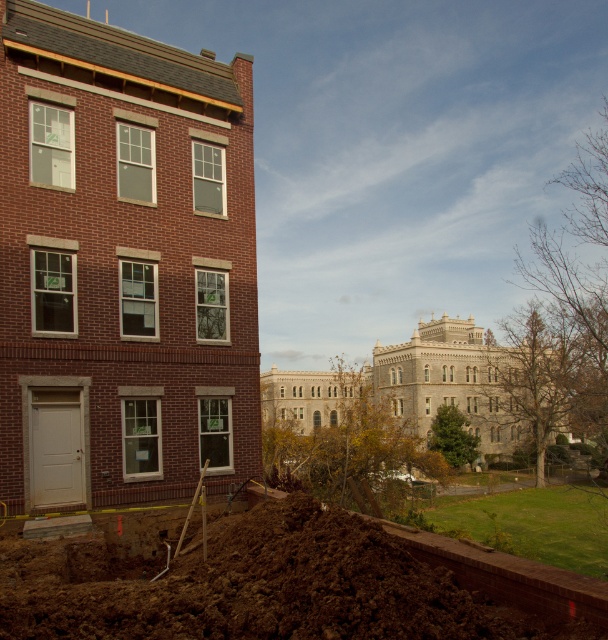
You are a construction worker standing at the point marked by coordinates point (x=122, y=262). Which object is directly behind you?

The point (x=122, y=262) indicates the brick building at left, so the brick building at left is directly behind you.